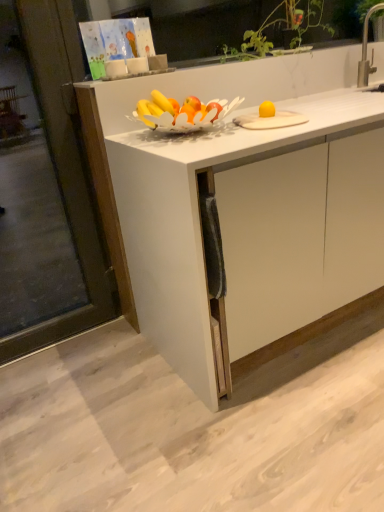
Question: Is silver metallic faucet at upper right in front of or behind white matte cabinet at center in the image?

Choices:
 (A) front
 (B) behind

Answer: (B)

Question: Looking at their shapes, would you say silver metallic faucet at upper right is wider or thinner than white matte cabinet at center?

Choices:
 (A) thin
 (B) wide

Answer: (A)

Question: Which object is positioned farthest from the silver metallic faucet at upper right?

Choices:
 (A) white matte cabinet at center
 (B) transparent glass screen door at left

Answer: (B)

Question: Considering the real-world distances, which object is closest to the white matte cabinet at center?

Choices:
 (A) transparent glass screen door at left
 (B) silver metallic faucet at upper right

Answer: (A)